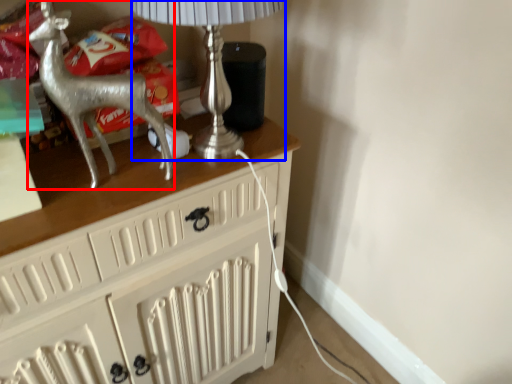
Question: Which object appears closest to the camera in this image, reindeer (highlighted by a red box) or table lamp (highlighted by a blue box)?

Choices:
 (A) reindeer
 (B) table lamp

Answer: (A)